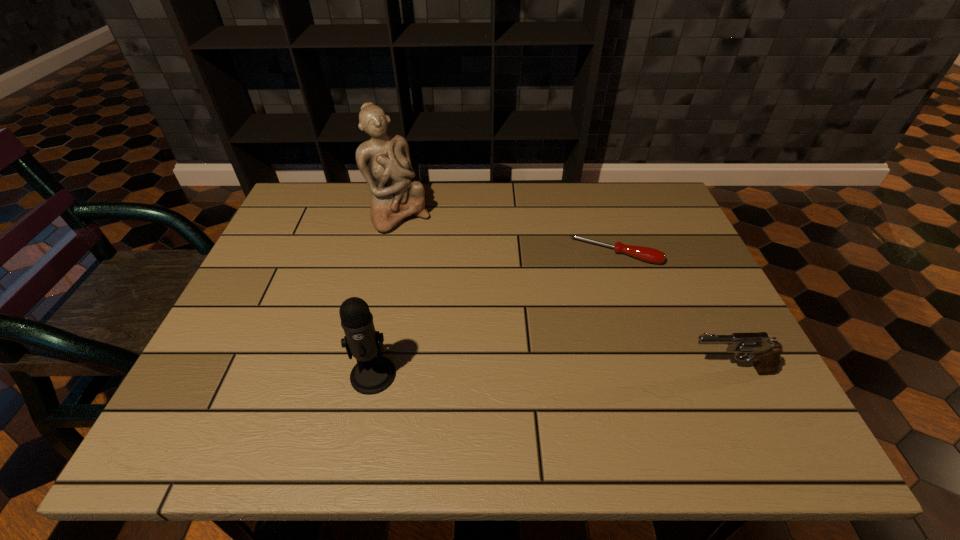
Identify the location of object that is the closest to the third shortest object. The width and height of the screenshot is (960, 540). pos(384,161).

Locate an element on the screen. The width and height of the screenshot is (960, 540). vacant space that satisfies the following two spatial constraints: 1. on the front side of the microphone; 2. on the right side of the figurine is located at coordinates pyautogui.click(x=364, y=374).

Image resolution: width=960 pixels, height=540 pixels. I want to click on free location that satisfies the following two spatial constraints: 1. on the back side of the pistol; 2. at the barrel of the microphone, so click(x=374, y=370).

Where is `free location that satisfies the following two spatial constraints: 1. on the front side of the pistol; 2. at the barrel of the screwdriver`? free location that satisfies the following two spatial constraints: 1. on the front side of the pistol; 2. at the barrel of the screwdriver is located at coordinates (654, 370).